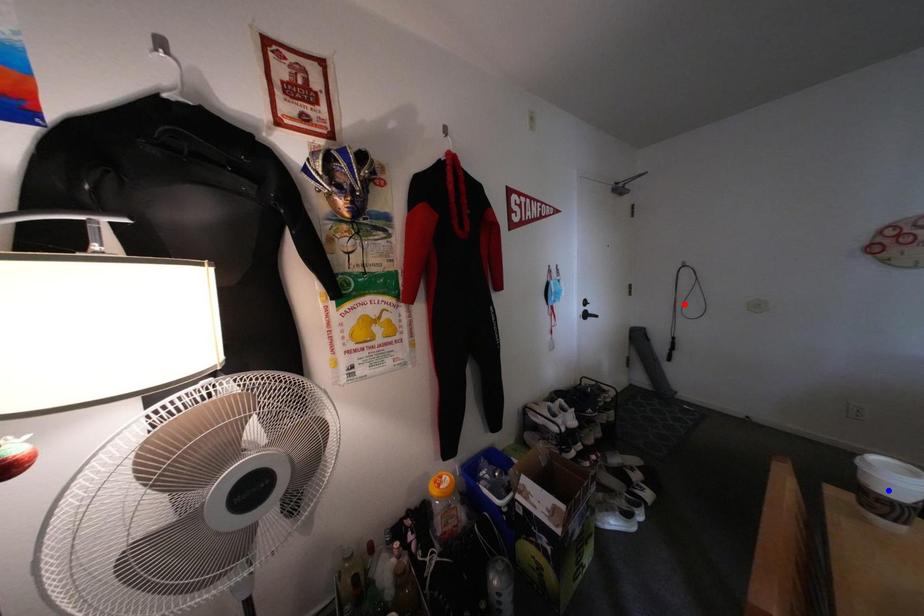
Question: Two points are marked on the image. Which point is closer to the camera?

Choices:
 (A) Blue point is closer.
 (B) Red point is closer.

Answer: (A)